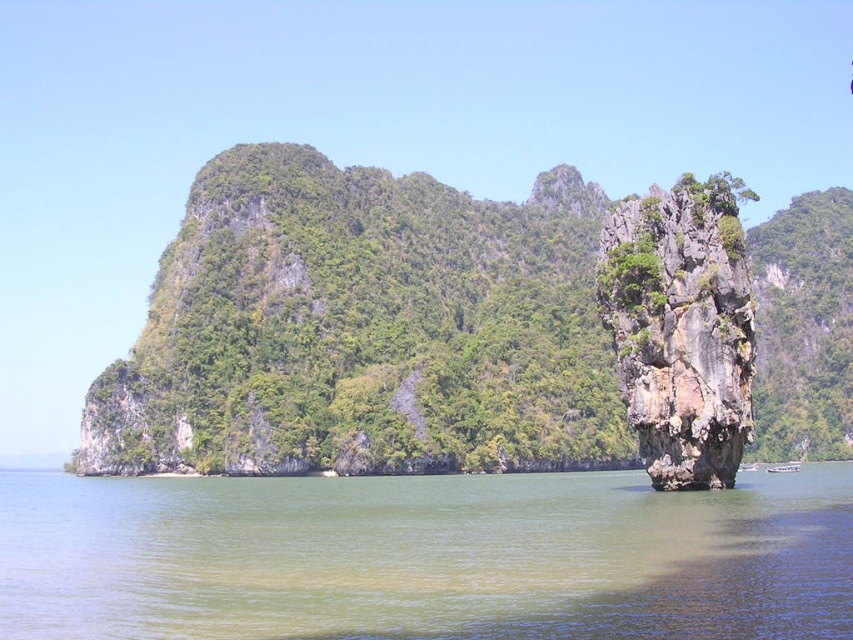
Who is positioned more to the right, green water at center or rugged stone rock at right?

Positioned to the right is rugged stone rock at right.

From the picture: Can you confirm if green water at center is positioned below rugged stone rock at right?

Correct, green water at center is located below rugged stone rock at right.

Does point (718, 564) come closer to viewer compared to point (712, 253)?

That is True.

Find the location of a particular element. green water at center is located at coordinates (425, 557).